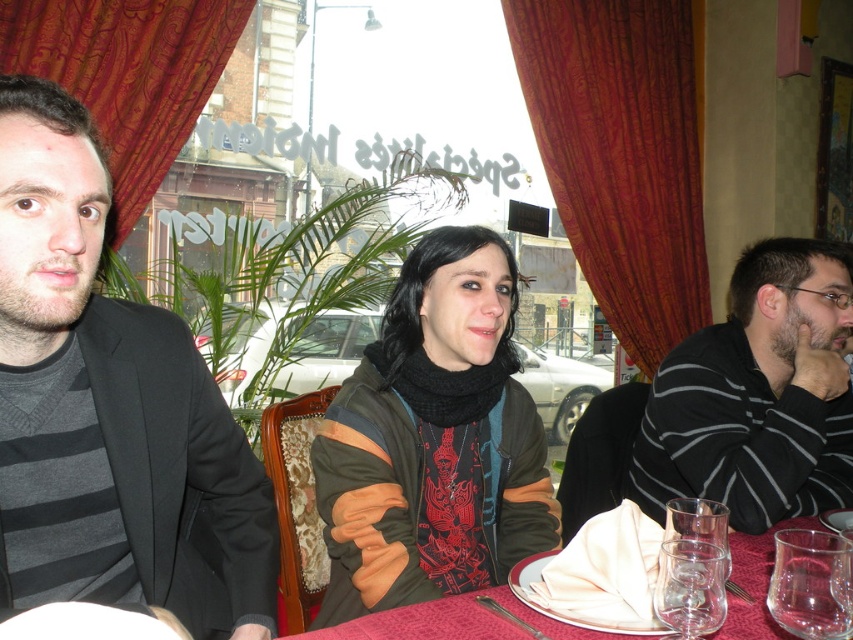
Question: Is dark green leather jacket at center below transparent glass at lower right?

Choices:
 (A) no
 (B) yes

Answer: (A)

Question: Which of the following is the farthest from the observer?

Choices:
 (A) (778, 380)
 (B) (148, 152)

Answer: (B)

Question: From the image, what is the correct spatial relationship of striped cotton shirt at right in relation to transparent glass wine glass at lower right?

Choices:
 (A) right
 (B) left

Answer: (A)

Question: Among these points, which one is nearest to the camera?

Choices:
 (A) (799, 573)
 (B) (270, 582)

Answer: (A)

Question: Which of the following is the closest to the observer?

Choices:
 (A) (32, 49)
 (B) (711, 332)

Answer: (B)

Question: Is wooden curtain at center bigger than transparent glass wine glass at lower right?

Choices:
 (A) no
 (B) yes

Answer: (B)